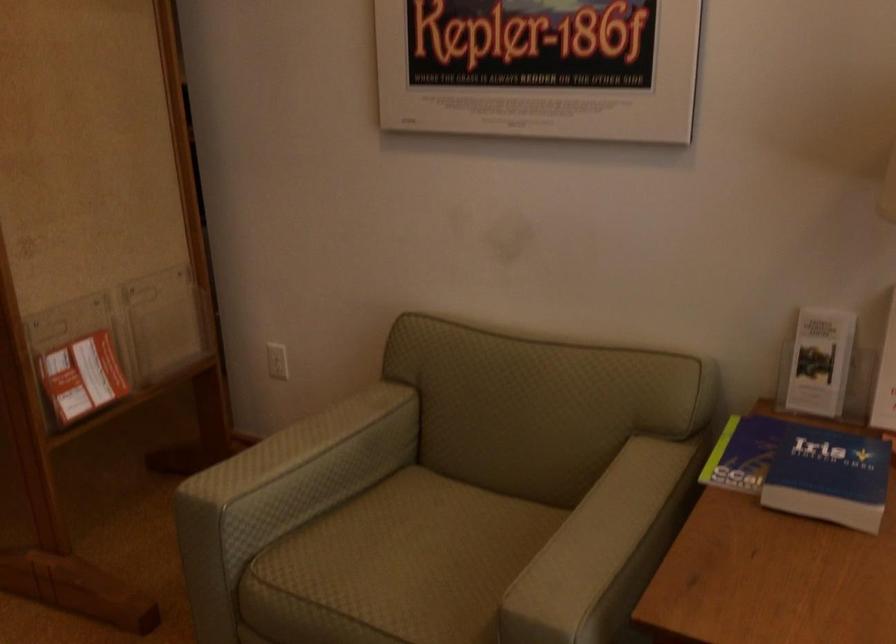
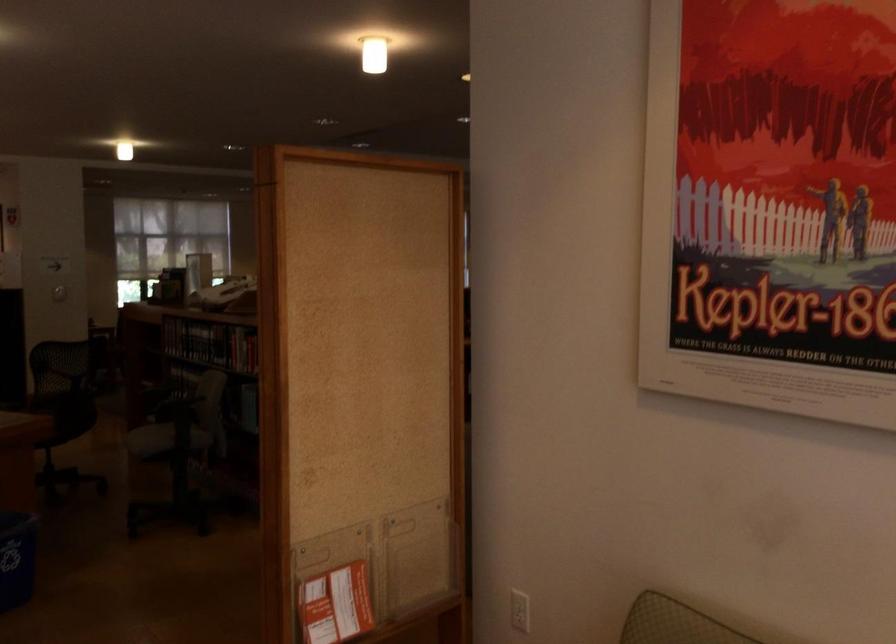
Locate, in the second image, the point that corresponds to point 82,384 in the first image.

(336, 605)